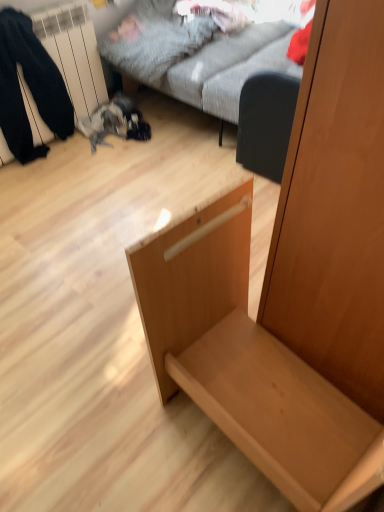
Question: Is textured gray fabric couch at upper center not near black matte swivel chair at center-right?

Choices:
 (A) no
 (B) yes

Answer: (A)

Question: From the image's perspective, is textured gray fabric couch at upper center located beneath black matte swivel chair at center-right?

Choices:
 (A) no
 (B) yes

Answer: (A)

Question: Is textured gray fabric couch at upper center facing away from black matte swivel chair at center-right?

Choices:
 (A) yes
 (B) no

Answer: (B)

Question: From the image's perspective, is textured gray fabric couch at upper center on top of black matte swivel chair at center-right?

Choices:
 (A) no
 (B) yes

Answer: (B)

Question: Does textured gray fabric couch at upper center lie in front of black matte swivel chair at center-right?

Choices:
 (A) yes
 (B) no

Answer: (A)

Question: Is textured gray fabric couch at upper center to the left or to the right of light wood drawer at center in the image?

Choices:
 (A) left
 (B) right

Answer: (B)

Question: From the image's perspective, relative to light wood drawer at center, is textured gray fabric couch at upper center above or below?

Choices:
 (A) above
 (B) below

Answer: (A)

Question: Considering the positions of point [188, 74] and point [367, 413], is point [188, 74] closer or farther from the camera than point [367, 413]?

Choices:
 (A) farther
 (B) closer

Answer: (A)

Question: Looking at their shapes, would you say textured gray fabric couch at upper center is wider or thinner than light wood drawer at center?

Choices:
 (A) wide
 (B) thin

Answer: (A)

Question: Considering their positions, is light wood drawer at center located in front of or behind black matte swivel chair at center-right?

Choices:
 (A) front
 (B) behind

Answer: (A)

Question: Would you say light wood drawer at center is to the left or to the right of black matte swivel chair at center-right in the picture?

Choices:
 (A) left
 (B) right

Answer: (A)

Question: From a real-world perspective, is light wood drawer at center positioned above or below black matte swivel chair at center-right?

Choices:
 (A) below
 (B) above

Answer: (B)

Question: From the image's perspective, is light wood drawer at center positioned above or below black matte swivel chair at center-right?

Choices:
 (A) above
 (B) below

Answer: (B)

Question: Considering the positions of black fabric pants at left and light wood drawer at center in the image, is black fabric pants at left wider or thinner than light wood drawer at center?

Choices:
 (A) thin
 (B) wide

Answer: (A)

Question: From their relative heights in the image, would you say black fabric pants at left is taller or shorter than light wood drawer at center?

Choices:
 (A) tall
 (B) short

Answer: (B)